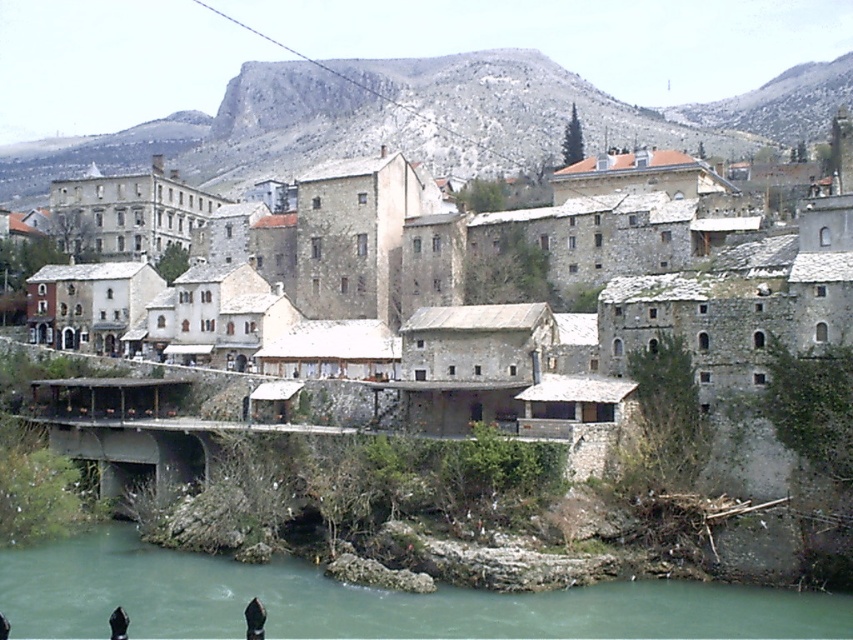
Consider the image. Is stone bridge at center to the left of snowy rocky hillside at upper center from the viewer's perspective?

Incorrect, stone bridge at center is not on the left side of snowy rocky hillside at upper center.

Who is taller, stone bridge at center or snowy rocky hillside at upper center?

Standing taller between the two is snowy rocky hillside at upper center.

Who is more forward, (x=519, y=403) or (x=376, y=140)?

Point (x=519, y=403) is in front.

Locate an element on the screen. This screenshot has width=853, height=640. stone bridge at center is located at coordinates (466, 292).

Is stone bridge at center taller than green stone river at lower center?

Correct, stone bridge at center is much taller as green stone river at lower center.

Can you confirm if stone bridge at center is thinner than green stone river at lower center?

No, stone bridge at center is not thinner than green stone river at lower center.

Find the location of a particular element. The height and width of the screenshot is (640, 853). stone bridge at center is located at coordinates (466, 292).

Is point (709, 125) positioned behind point (785, 611)?

That is True.

This screenshot has width=853, height=640. I want to click on snowy rocky hillside at upper center, so click(x=426, y=122).